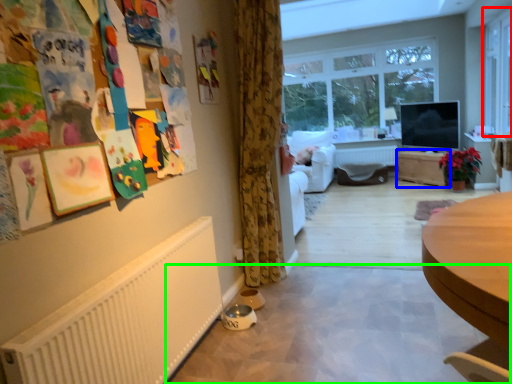
Question: Which object is the farthest from window (highlighted by a red box)? Choose among these: table (highlighted by a blue box) or plain (highlighted by a green box).

Choices:
 (A) table
 (B) plain

Answer: (B)